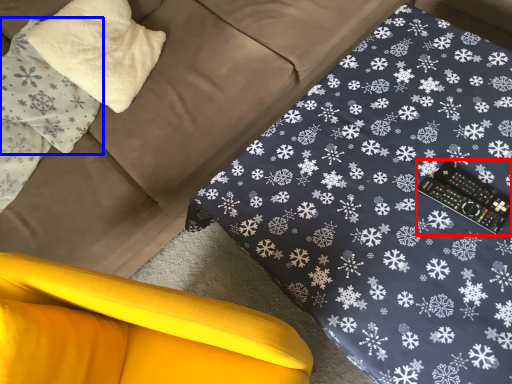
Question: Which point is closer to the camera, control (highlighted by a red box) or pillow (highlighted by a blue box)?

Choices:
 (A) control
 (B) pillow

Answer: (A)